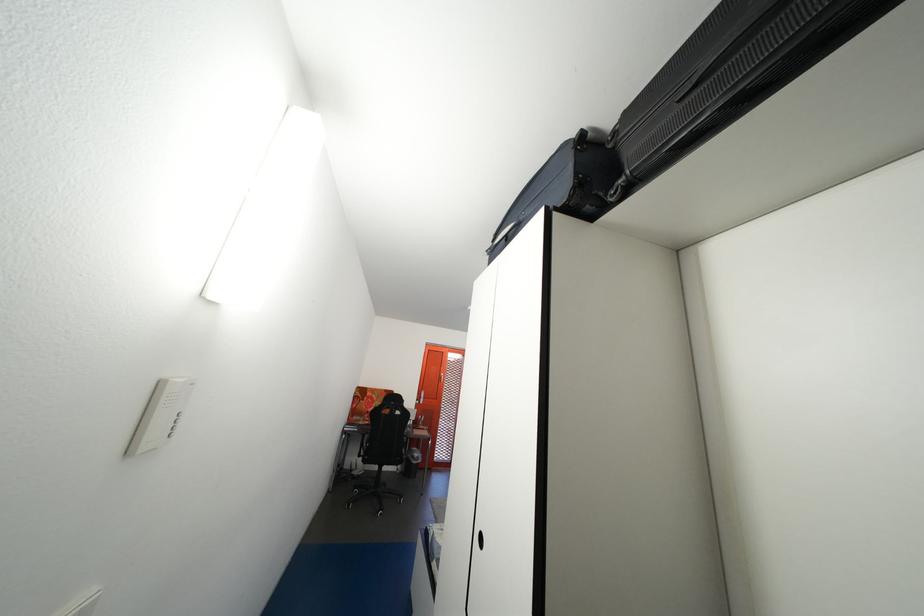
This screenshot has height=616, width=924. Identify the location of chair sitting surface. (383, 466).